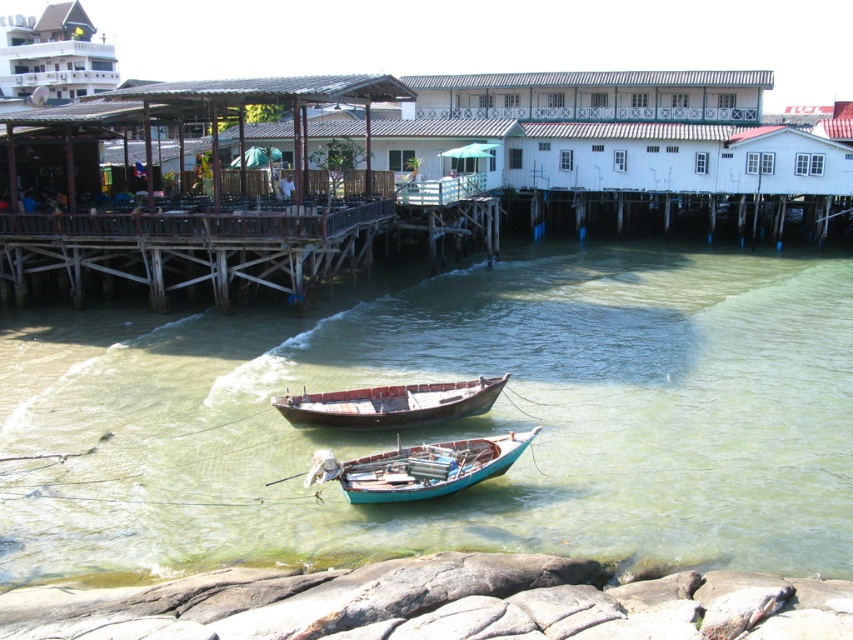
Question: In this image, where is clear water at center located relative to rusty wooden boat at center?

Choices:
 (A) above
 (B) below

Answer: (A)

Question: Does clear water at center have a larger size compared to rusty wooden boat at center?

Choices:
 (A) yes
 (B) no

Answer: (A)

Question: Considering the real-world distances, which object is farthest from the rusty wooden boat at center?

Choices:
 (A) teal wooden boat at center
 (B) clear water at center

Answer: (B)

Question: Which is farther from the teal wooden boat at center?

Choices:
 (A) clear water at center
 (B) rusty wooden boat at center

Answer: (A)

Question: Does clear water at center appear under teal wooden boat at center?

Choices:
 (A) no
 (B) yes

Answer: (A)

Question: Which point is farther to the camera?

Choices:
 (A) (437, 445)
 (B) (508, 502)
 (C) (392, 404)

Answer: (C)